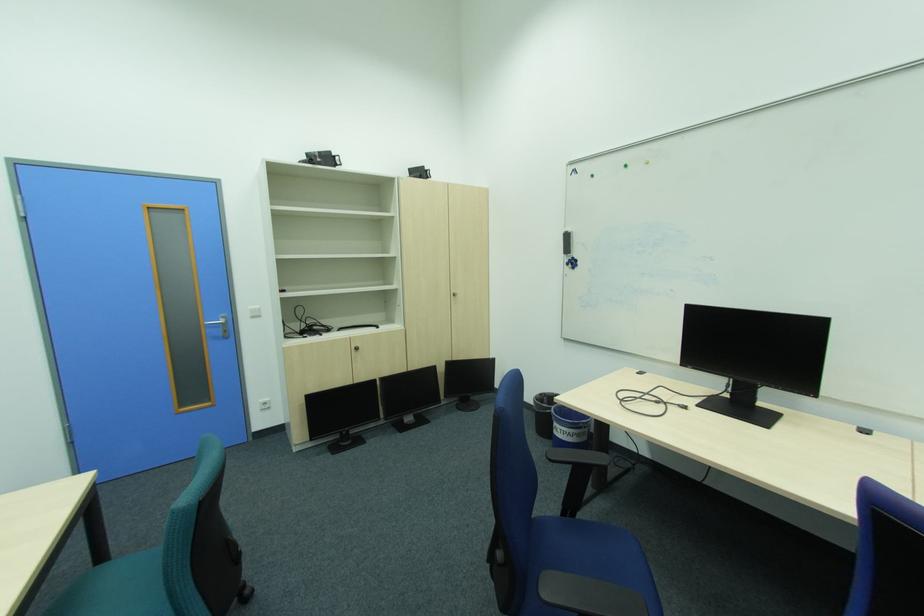
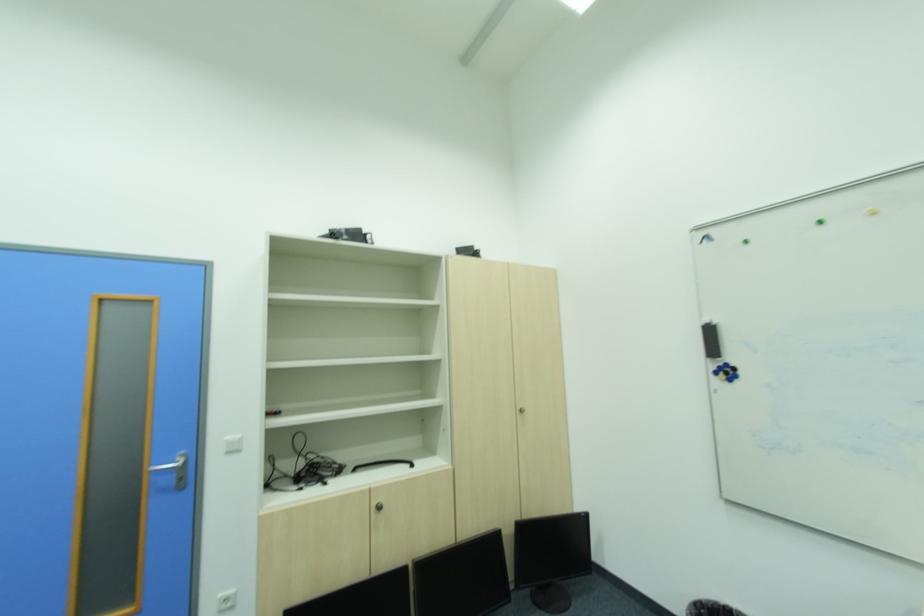
Question: In a continuous first-person perspective shot, in which direction is the camera moving?

Choices:
 (A) Left
 (B) Right
 (C) Forward
 (D) Backward

Answer: (C)